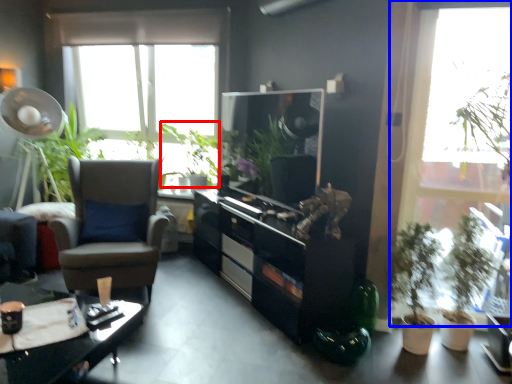
Question: Which object appears closest to the camera in this image, vegetation (highlighted by a red box) or window (highlighted by a blue box)?

Choices:
 (A) vegetation
 (B) window

Answer: (B)